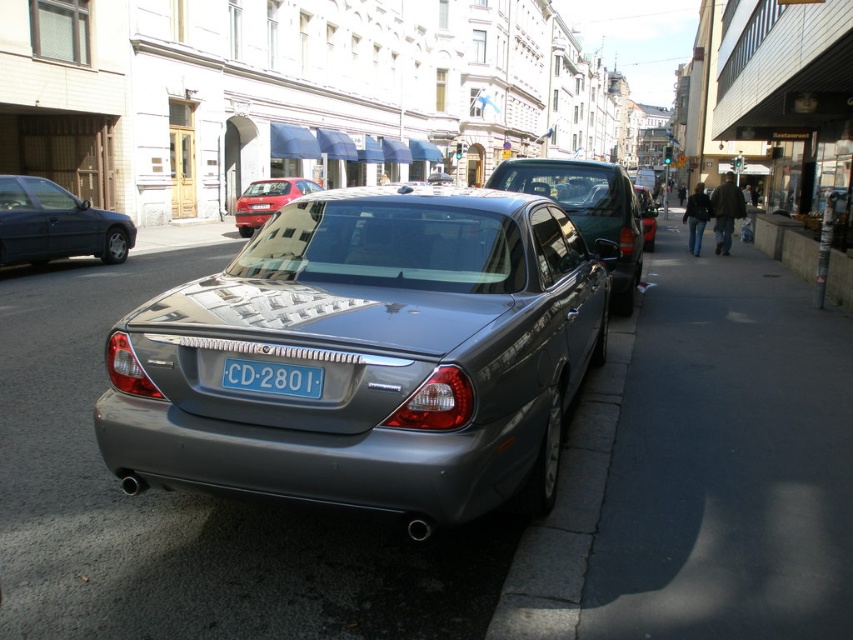
You are standing on the street looking at the silver Jaguar car parked on the right. There are two points marked in the image. The first point is at coordinate (642, 250) and the second point is at (264, 218). Which of these two points is nearer to your viewpoint?

Point (642, 250) is closer to the camera than point (264, 218).

You are a delivery driver who needs to park your 5.5 meter long truck in this street. The truck requires a parking space that is at least 6 meters long. You see the satin silver sedan at center and the blue metallic license plate at center in the image. Can you determine if there is enough space between them to park your truck?

The satin silver sedan at center and blue metallic license plate at center are 4.87 meters apart. Since your truck requires a parking space of at least 6 meters, the available space between them is insufficient for parking.

You are standing at the center of the street and see a point marked at coordinates [587,211]. Based on the scene description, what object does this point correspond to?

The point corresponds to the satin silver sedan at center.